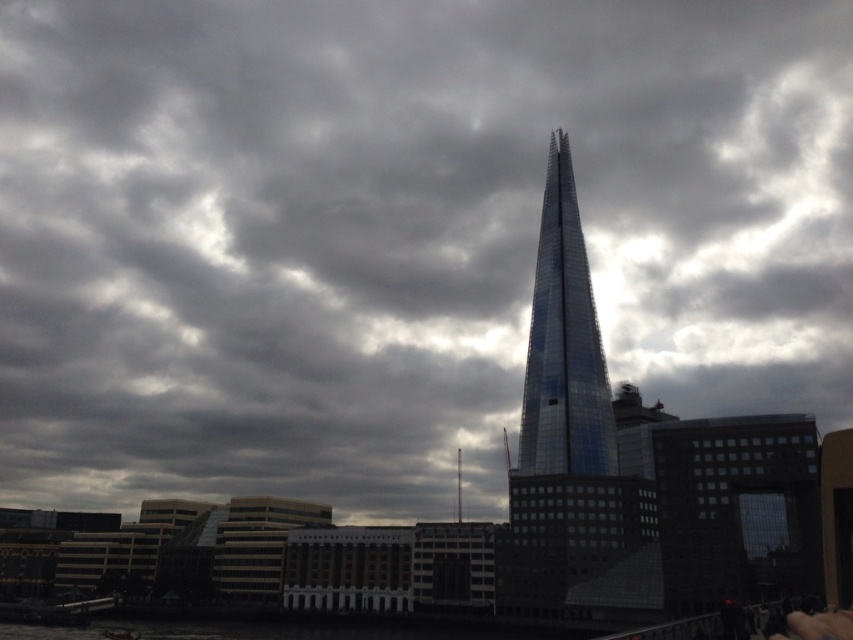
Consider the image. You are a tourist visiting London and want to take a photo of both the shiny glass tower at center and the glassy metallic spire at center. However, your camera has a limited zoom range. Based on their sizes in the image, which one should you focus on first to ensure both are visible in the frame?

The shiny glass tower at center is bigger than the glassy metallic spire at center, so you should focus on the shiny glass tower at center first to ensure both are visible in the frame.

You are a drone operator tasked with flying a drone between the glassy steel tower at center and the glassy metallic spire at center. The drone has a maximum flight distance of 80 meters. Based on the scene, can the drone safely make the trip between them?

The distance between the glassy steel tower at center and the glassy metallic spire at center is 76.76 meters, which is within the drone operator s maximum flight distance of 80 meters. Therefore, the drone can safely make the trip between them.